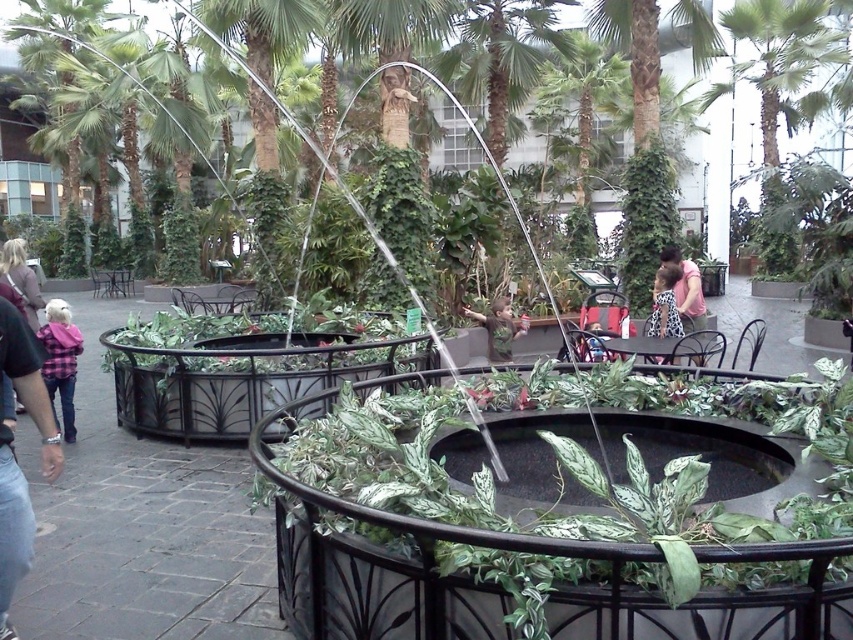
Does matte pink shirt at center have a smaller size compared to polka dot skirt at center?

Actually, matte pink shirt at center might be larger than polka dot skirt at center.

Is point (672, 244) positioned behind point (663, 326)?

Yes, point (672, 244) is behind point (663, 326).

I want to click on matte pink shirt at center, so click(686, 289).

How distant is denim jacket at left from polka dot skirt at center?

denim jacket at left is 20.09 feet from polka dot skirt at center.

Is denim jacket at left shorter than polka dot skirt at center?

No.

Does point (22, 524) lie in front of point (654, 316)?

Yes, point (22, 524) is in front of point (654, 316).

I want to click on denim jacket at left, so click(x=12, y=525).

Which is below, polka dot skirt at center or camouflage fabric shirt at center?

Positioned lower is camouflage fabric shirt at center.

Is polka dot skirt at center shorter than camouflage fabric shirt at center?

Indeed, polka dot skirt at center has a lesser height compared to camouflage fabric shirt at center.

The image size is (853, 640). What are the coordinates of `polka dot skirt at center` in the screenshot? It's located at (664, 304).